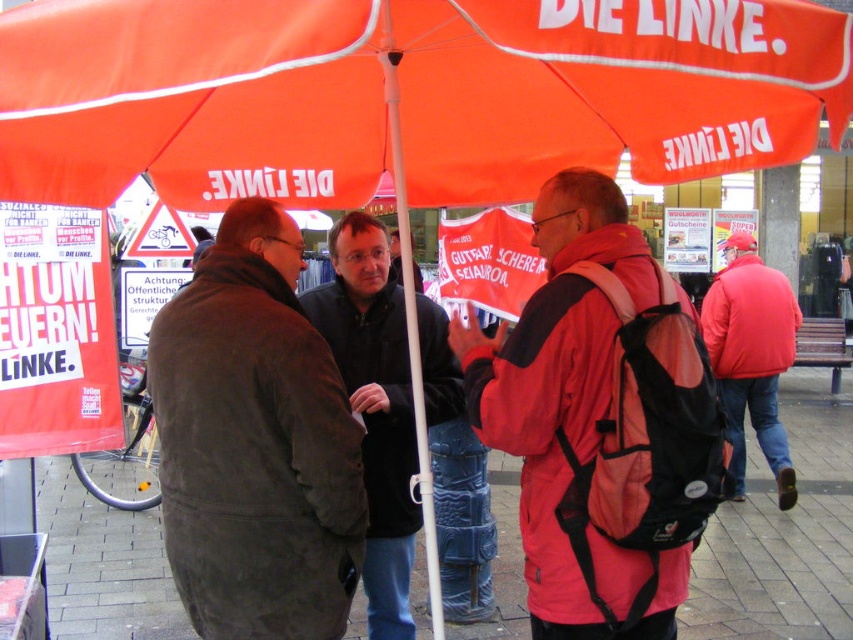
You are standing under the large red umbrella and want to know if the dark gray jacket at center is taller than the white plastic pole at center. Based on the scene description, what can you conclude?

The dark gray jacket at center is shorter than the white plastic pole at center according to the description.